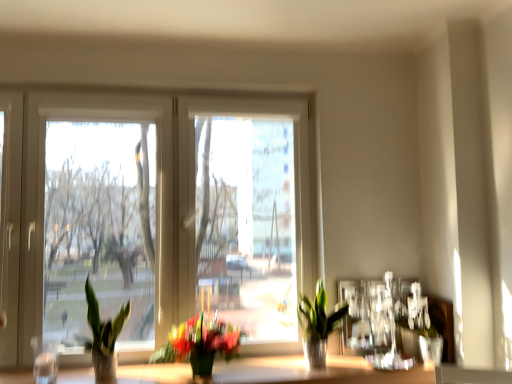
Describe the element at coordinates (102, 337) in the screenshot. I see `green matte plant at left, which ranks as the 3th houseplant in right-to-left order` at that location.

Find the location of a particular element. green matte plant at left, which is the first houseplant in left-to-right order is located at coordinates (102, 337).

Considering the relative sizes of green matte plant at left, which is the first houseplant in left-to-right order, and green matte plant at center, positioned as the 2th houseplant in right-to-left order, in the image provided, is green matte plant at left, which is the first houseplant in left-to-right order, thinner than green matte plant at center, positioned as the 2th houseplant in right-to-left order,?

Yes.

Which of these two, green matte plant at left, which is the first houseplant in left-to-right order, or green matte plant at center, arranged as the 2th houseplant when viewed from the left, stands shorter?

Standing shorter between the two is green matte plant at center, arranged as the 2th houseplant when viewed from the left.

How different are the orientations of green matte plant at left, which is the first houseplant in left-to-right order, and green matte plant at center, positioned as the 2th houseplant in right-to-left order, in degrees?

The angle between the facing direction of green matte plant at left, which is the first houseplant in left-to-right order, and the facing direction of green matte plant at center, positioned as the 2th houseplant in right-to-left order, is 1.07e-05 degrees.

Which of these two, green matte plant at left, which ranks as the 3th houseplant in right-to-left order, or green matte plant at center, arranged as the 2th houseplant when viewed from the left, is smaller?

With smaller size is green matte plant at left, which ranks as the 3th houseplant in right-to-left order.

From the image's perspective, which houseplant is the 2nd one below the white plastic window at center? Please provide its 2D coordinates.

[(318, 325)]

Which object is positioned more to the left, white plastic window at center or green glossy plant at center, placed as the 3th houseplant when sorted from left to right?

From the viewer's perspective, white plastic window at center appears more on the left side.

Does point (221, 279) lie behind point (310, 355)?

Yes, point (221, 279) is farther from viewer.

Consider the image. Can you tell me how much white plastic window at center and green glossy plant at center, the first houseplant in the right-to-left sequence, differ in facing direction?

0.96 degrees separate the facing orientations of white plastic window at center and green glossy plant at center, the first houseplant in the right-to-left sequence.

Between point (311, 315) and point (352, 370), which one is positioned behind?

Point (311, 315)

Which of these two, green glossy plant at center, the first houseplant in the right-to-left sequence, or smooth wooden surface at lower center, is thinner?

Thinner between the two is green glossy plant at center, the first houseplant in the right-to-left sequence.

Considering the sizes of objects green glossy plant at center, the first houseplant in the right-to-left sequence, and smooth wooden surface at lower center in the image provided, who is smaller, green glossy plant at center, the first houseplant in the right-to-left sequence, or smooth wooden surface at lower center?

green glossy plant at center, the first houseplant in the right-to-left sequence, is smaller.

At what (x,y) coordinates should I click in order to perform the action: click on the 3rd houseplant behind the smooth wooden surface at lower center, counting from the anchor's position. Please return your answer as a coordinate pair (x, y). This screenshot has width=512, height=384. Looking at the image, I should click on (318, 325).

Are smooth wooden surface at lower center and green matte plant at left, which ranks as the 3th houseplant in right-to-left order, far apart?

No.

Looking at the image, does smooth wooden surface at lower center seem bigger or smaller compared to green matte plant at left, which ranks as the 3th houseplant in right-to-left order?

smooth wooden surface at lower center is bigger than green matte plant at left, which ranks as the 3th houseplant in right-to-left order.

Between smooth wooden surface at lower center and green matte plant at left, which is the first houseplant in left-to-right order, which one has less height?

smooth wooden surface at lower center.

Based on the photo, from a real-world perspective, is smooth wooden surface at lower center physically below green matte plant at left, which ranks as the 3th houseplant in right-to-left order?

Yes, from a real-world perspective, smooth wooden surface at lower center is under green matte plant at left, which ranks as the 3th houseplant in right-to-left order.

Between green matte plant at center, positioned as the 2th houseplant in right-to-left order, and smooth wooden surface at lower center, which one has smaller width?

Thinner between the two is green matte plant at center, positioned as the 2th houseplant in right-to-left order.

Which object is further away from the camera, green matte plant at center, positioned as the 2th houseplant in right-to-left order, or smooth wooden surface at lower center?

green matte plant at center, positioned as the 2th houseplant in right-to-left order, is behind.

Which of these two, green matte plant at center, positioned as the 2th houseplant in right-to-left order, or smooth wooden surface at lower center, stands shorter?

smooth wooden surface at lower center.

Who is taller, green matte plant at center, positioned as the 2th houseplant in right-to-left order, or green matte plant at left, which ranks as the 3th houseplant in right-to-left order?

green matte plant at left, which ranks as the 3th houseplant in right-to-left order.

Considering the relative positions of green matte plant at center, arranged as the 2th houseplant when viewed from the left, and green matte plant at left, which ranks as the 3th houseplant in right-to-left order, in the image provided, is green matte plant at center, arranged as the 2th houseplant when viewed from the left, to the left or to the right of green matte plant at left, which ranks as the 3th houseplant in right-to-left order,?

From the image, it's evident that green matte plant at center, arranged as the 2th houseplant when viewed from the left, is to the right of green matte plant at left, which ranks as the 3th houseplant in right-to-left order.

Between green matte plant at center, positioned as the 2th houseplant in right-to-left order, and green matte plant at left, which ranks as the 3th houseplant in right-to-left order, which one has larger size?

With larger size is green matte plant at center, positioned as the 2th houseplant in right-to-left order.

Does green matte plant at center, positioned as the 2th houseplant in right-to-left order, contain green matte plant at left, which is the first houseplant in left-to-right order?

No.

Considering the positions of objects smooth wooden surface at lower center and green glossy plant at center, placed as the 3th houseplant when sorted from left to right, in the image provided, who is more to the right, smooth wooden surface at lower center or green glossy plant at center, placed as the 3th houseplant when sorted from left to right,?

From the viewer's perspective, green glossy plant at center, placed as the 3th houseplant when sorted from left to right, appears more on the right side.

How different are the orientations of smooth wooden surface at lower center and green glossy plant at center, the first houseplant in the right-to-left sequence, in degrees?

There is a 1.38-degree angle between the facing directions of smooth wooden surface at lower center and green glossy plant at center, the first houseplant in the right-to-left sequence.

Does smooth wooden surface at lower center have a larger size compared to green glossy plant at center, the first houseplant in the right-to-left sequence?

Yes, smooth wooden surface at lower center is bigger than green glossy plant at center, the first houseplant in the right-to-left sequence.

Which houseplant is the 1st one when counting from the right side of the green matte plant at left, which ranks as the 3th houseplant in right-to-left order? Please provide its 2D coordinates.

[(199, 345)]

From the image's perspective, which houseplant is the 2nd one below the white plastic window at center? Please provide its 2D coordinates.

[(318, 325)]

In the scene shown: Estimate the real-world distances between objects in this image. Which object is further from green glossy plant at center, the first houseplant in the right-to-left sequence, green matte plant at left, which ranks as the 3th houseplant in right-to-left order, or green matte plant at center, arranged as the 2th houseplant when viewed from the left?

green matte plant at left, which ranks as the 3th houseplant in right-to-left order, is further to green glossy plant at center, the first houseplant in the right-to-left sequence.

Looking at the image, which one is located closer to green glossy plant at center, the first houseplant in the right-to-left sequence, green matte plant at center, arranged as the 2th houseplant when viewed from the left, or white plastic window at center?

green matte plant at center, arranged as the 2th houseplant when viewed from the left.

Based on their spatial positions, is green glossy plant at center, the first houseplant in the right-to-left sequence, or smooth wooden surface at lower center further from green matte plant at center, arranged as the 2th houseplant when viewed from the left?

green glossy plant at center, the first houseplant in the right-to-left sequence, is further to green matte plant at center, arranged as the 2th houseplant when viewed from the left.

Considering their positions, is white plastic window at center positioned closer to green matte plant at center, arranged as the 2th houseplant when viewed from the left, than green matte plant at left, which ranks as the 3th houseplant in right-to-left order?

The object closer to green matte plant at center, arranged as the 2th houseplant when viewed from the left, is green matte plant at left, which ranks as the 3th houseplant in right-to-left order.

Based on their spatial positions, is smooth wooden surface at lower center or white plastic window at center closer to green matte plant at center, arranged as the 2th houseplant when viewed from the left?

smooth wooden surface at lower center lies closer to green matte plant at center, arranged as the 2th houseplant when viewed from the left, than the other object.

Which object lies further to the anchor point green matte plant at left, which is the first houseplant in left-to-right order, green matte plant at center, arranged as the 2th houseplant when viewed from the left, or smooth wooden surface at lower center?

smooth wooden surface at lower center is further to green matte plant at left, which is the first houseplant in left-to-right order.

Which object lies nearer to the anchor point green matte plant at center, positioned as the 2th houseplant in right-to-left order, white plastic window at center or green glossy plant at center, the first houseplant in the right-to-left sequence?

white plastic window at center is closer to green matte plant at center, positioned as the 2th houseplant in right-to-left order.

Considering their positions, is green glossy plant at center, the first houseplant in the right-to-left sequence, positioned further to white plastic window at center than green matte plant at left, which is the first houseplant in left-to-right order?

green glossy plant at center, the first houseplant in the right-to-left sequence, is positioned further to the anchor white plastic window at center.

I want to click on window sill between white plastic window at center and green glossy plant at center, placed as the 3th houseplant when sorted from left to right, in the horizontal direction, so click(314, 372).

Image resolution: width=512 pixels, height=384 pixels. Identify the location of houseplant situated between green matte plant at left, which is the first houseplant in left-to-right order, and smooth wooden surface at lower center from left to right. (199, 345).

Where is `window located between green matte plant at left, which ranks as the 3th houseplant in right-to-left order, and green glossy plant at center, the first houseplant in the right-to-left sequence, in the left-right direction`? window located between green matte plant at left, which ranks as the 3th houseplant in right-to-left order, and green glossy plant at center, the first houseplant in the right-to-left sequence, in the left-right direction is located at coordinates (154, 216).

The width and height of the screenshot is (512, 384). Find the location of `window sill between green matte plant at left, which is the first houseplant in left-to-right order, and green glossy plant at center, placed as the 3th houseplant when sorted from left to right, from left to right`. window sill between green matte plant at left, which is the first houseplant in left-to-right order, and green glossy plant at center, placed as the 3th houseplant when sorted from left to right, from left to right is located at coordinates 314,372.